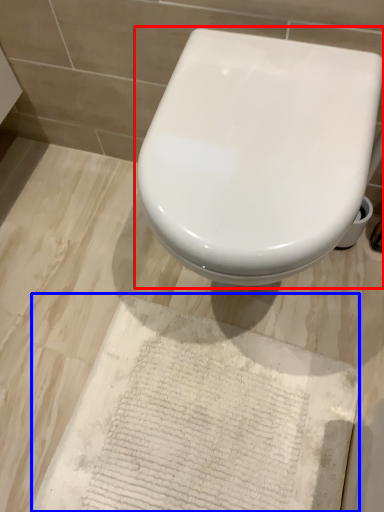
Question: Among these objects, which one is nearest to the camera, toilet (highlighted by a red box) or parchment (highlighted by a blue box)?

Choices:
 (A) toilet
 (B) parchment

Answer: (A)